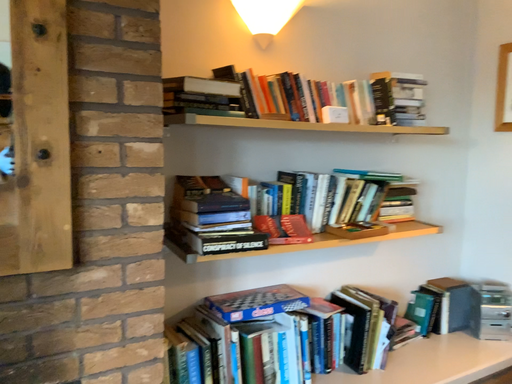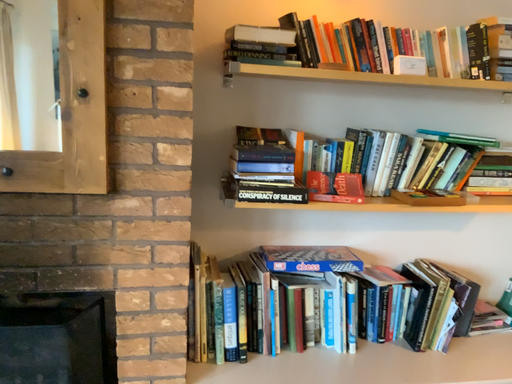
Question: How did the camera likely rotate when shooting the video?

Choices:
 (A) rotated left
 (B) rotated right

Answer: (A)